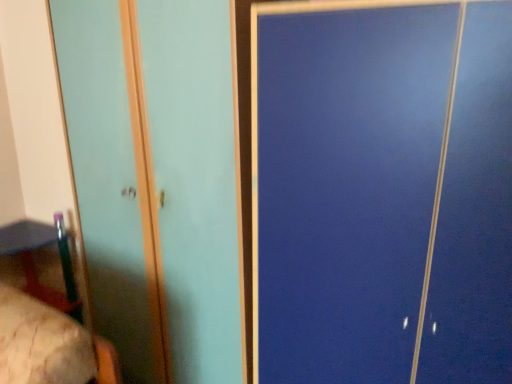
This screenshot has height=384, width=512. What do you see at coordinates (34, 264) in the screenshot? I see `wooden table at lower left` at bounding box center [34, 264].

What are the coordinates of `matte teal screen door at left` in the screenshot? It's located at (195, 181).

Where is `wooden bed at lower left`? The width and height of the screenshot is (512, 384). wooden bed at lower left is located at coordinates (41, 343).

You are a GUI agent. You are given a task and a screenshot of the screen. Output one action in this format:
    pyautogui.click(x=<x>, y=<y>)
    Task: Click on the wooden table at lower left
    The height and width of the screenshot is (384, 512).
    Given the screenshot: What is the action you would take?
    pyautogui.click(x=34, y=264)

Does wooden table at lower left have a greater height compared to matte teal screen door at left?

No.

Looking at this image, would you say wooden table at lower left is a long distance from matte teal screen door at left?

No, wooden table at lower left is not far from matte teal screen door at left.

Which object is wider, wooden table at lower left or matte teal screen door at left?

With larger width is matte teal screen door at left.

Which point is more forward, (76, 300) or (123, 331)?

Positioned in front is point (123, 331).

Is matte teal screen door at left far away from wooden table at lower left?

That's not correct — matte teal screen door at left is a little close to wooden table at lower left.

Can you confirm if matte teal screen door at left is positioned to the left of wooden table at lower left?

Incorrect, matte teal screen door at left is not on the left side of wooden table at lower left.

Does wooden bed at lower left have a greater height compared to matte teal screen door at left?

Incorrect, the height of wooden bed at lower left is not larger of that of matte teal screen door at left.

The width and height of the screenshot is (512, 384). What are the coordinates of `mattress beneath the matte teal screen door at left (from a real-world perspective)` in the screenshot? It's located at (41, 343).

Considering the relative sizes of wooden bed at lower left and matte teal screen door at left in the image provided, is wooden bed at lower left thinner than matte teal screen door at left?

Indeed, wooden bed at lower left has a lesser width compared to matte teal screen door at left.

From the image's perspective, is wooden bed at lower left on top of wooden table at lower left?

Incorrect, from the image's perspective, wooden bed at lower left is lower than wooden table at lower left.

Is wooden bed at lower left oriented towards wooden table at lower left?

No, wooden bed at lower left is not aimed at wooden table at lower left.

Considering the positions of objects wooden bed at lower left and wooden table at lower left in the image provided, who is more to the left, wooden bed at lower left or wooden table at lower left?

wooden table at lower left is more to the left.

Between wooden bed at lower left and wooden table at lower left, which one has less height?

wooden bed at lower left.

Considering the relative sizes of matte teal screen door at left and wooden bed at lower left in the image provided, is matte teal screen door at left shorter than wooden bed at lower left?

Incorrect, the height of matte teal screen door at left does not fall short of that of wooden bed at lower left.

From the image's perspective, is matte teal screen door at left located beneath wooden bed at lower left?

Actually, matte teal screen door at left appears above wooden bed at lower left in the image.

How different are the orientations of matte teal screen door at left and wooden bed at lower left in degrees?

The angular difference between matte teal screen door at left and wooden bed at lower left is 0.218 degrees.

Does point (117, 44) appear closer or farther from the camera than point (71, 354)?

Point (117, 44) appears to be farther away from the viewer than point (71, 354).

Which is behind, wooden table at lower left or wooden bed at lower left?

wooden table at lower left.

What's the angular difference between wooden table at lower left and wooden bed at lower left's facing directions?

wooden table at lower left and wooden bed at lower left are facing 91.2 degrees away from each other.

Does point (67, 267) lie behind point (50, 337)?

Yes, it is.

This screenshot has width=512, height=384. In order to click on table behind the matte teal screen door at left in this screenshot , I will do `click(34, 264)`.

In the image, there is a wooden table at lower left. At what (x,y) coordinates should I click in order to perform the action: click on screen door above it (from the image's perspective). Please return your answer as a coordinate pair (x, y). This screenshot has width=512, height=384. Looking at the image, I should click on (195, 181).

From the picture: Which object lies further to the anchor point wooden table at lower left, wooden bed at lower left or matte teal screen door at left?

wooden bed at lower left.

Based on their spatial positions, is wooden table at lower left or wooden bed at lower left closer to matte teal screen door at left?

Among the two, wooden table at lower left is located nearer to matte teal screen door at left.

When comparing their distances from matte teal screen door at left, does wooden bed at lower left or wooden table at lower left seem closer?

wooden table at lower left is positioned closer to the anchor matte teal screen door at left.

From the image, which object appears to be nearer to wooden bed at lower left, wooden table at lower left or matte teal screen door at left?

matte teal screen door at left is closer to wooden bed at lower left.

Estimate the real-world distances between objects in this image. Which object is further from wooden table at lower left, matte teal screen door at left or wooden bed at lower left?

wooden bed at lower left.

Which object lies further to the anchor point wooden bed at lower left, matte teal screen door at left or wooden table at lower left?

Among the two, wooden table at lower left is located further to wooden bed at lower left.

Where is `mattress between wooden table at lower left and matte teal screen door at left`? Image resolution: width=512 pixels, height=384 pixels. mattress between wooden table at lower left and matte teal screen door at left is located at coordinates (41, 343).